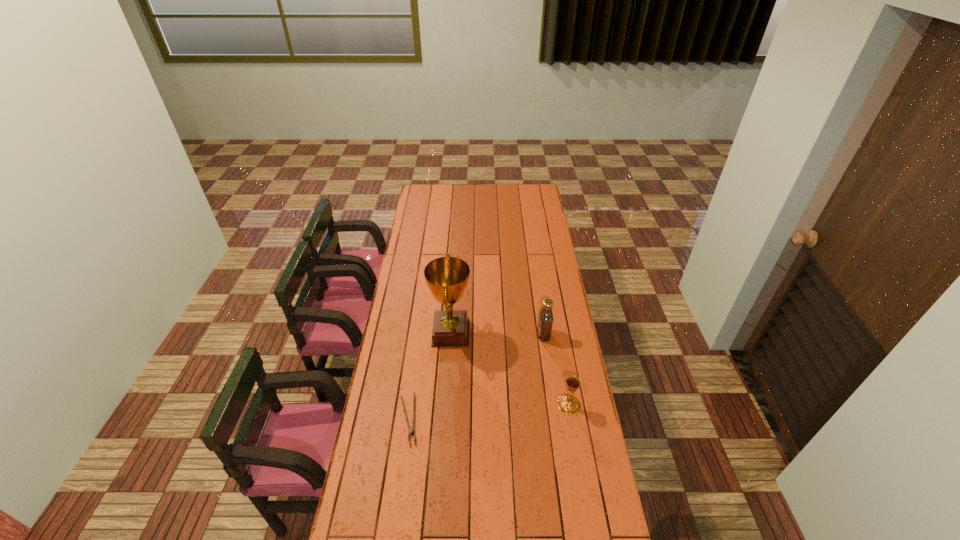
Image resolution: width=960 pixels, height=540 pixels. I want to click on vacant space located 0.400m on the front of the chalice, so click(590, 529).

This screenshot has height=540, width=960. Identify the location of vacant space situated on the right of the leftmost object. (456, 420).

Find the location of a particular element. The image size is (960, 540). object at the left edge is located at coordinates (411, 430).

At what (x,y) coordinates should I click in order to perform the action: click on vodka that is at the right edge. Please return your answer as a coordinate pair (x, y). Looking at the image, I should click on (545, 322).

The height and width of the screenshot is (540, 960). Identify the location of chalice present at the right edge. (568, 404).

The image size is (960, 540). In the image, there is a desktop. In order to click on vacant space at the far edge in this screenshot , I will do `click(496, 185)`.

Where is `vacant region at the left edge of the desktop`? Image resolution: width=960 pixels, height=540 pixels. vacant region at the left edge of the desktop is located at coordinates (422, 289).

You are a GUI agent. You are given a task and a screenshot of the screen. Output one action in this format:
    pyautogui.click(x=<x>, y=<y>)
    Task: Click on the vacant space at the right edge of the desktop
    The height and width of the screenshot is (540, 960).
    Given the screenshot: What is the action you would take?
    pyautogui.click(x=585, y=395)

The image size is (960, 540). Find the location of `free region at the far right corner of the desktop`. free region at the far right corner of the desktop is located at coordinates (525, 188).

Where is `unoccupied area between the leftmost object and the second tallest object`? The width and height of the screenshot is (960, 540). unoccupied area between the leftmost object and the second tallest object is located at coordinates (476, 377).